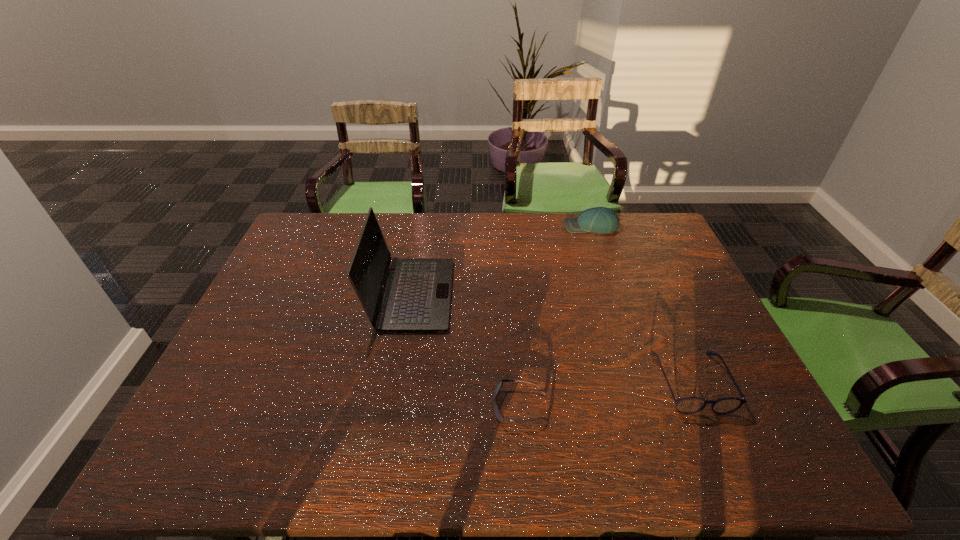
Locate an element on the screen. The image size is (960, 540). vacant space located 0.160m on the lenses of the shortest object is located at coordinates 424,407.

Where is `vacant space located 0.310m on the lenses of the shortest object`? vacant space located 0.310m on the lenses of the shortest object is located at coordinates (359, 407).

Locate an element on the screen. object positioned at the far edge is located at coordinates (604, 220).

Image resolution: width=960 pixels, height=540 pixels. What are the coordinates of `baseball cap located in the right edge section of the desktop` in the screenshot? It's located at click(604, 220).

Find the location of a particular element. spectacles located in the right edge section of the desktop is located at coordinates (690, 405).

Locate an element on the screen. The image size is (960, 540). object present at the far right corner is located at coordinates pos(604,220).

Where is `vacant point at the far edge`? vacant point at the far edge is located at coordinates (603, 242).

In the image, there is a desktop. Identify the location of vacant region at the near edge. (267, 462).

Where is `free space at the left edge of the desktop`? Image resolution: width=960 pixels, height=540 pixels. free space at the left edge of the desktop is located at coordinates (257, 313).

In the image, there is a desktop. Where is `vacant region at the right edge`? The width and height of the screenshot is (960, 540). vacant region at the right edge is located at coordinates (675, 302).